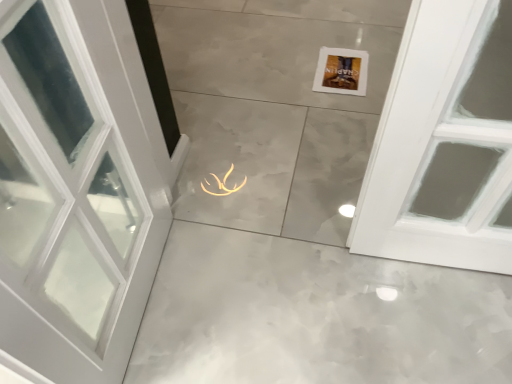
This screenshot has height=384, width=512. I want to click on vacant area that is in front of matte gold postcard at upper right, so click(341, 109).